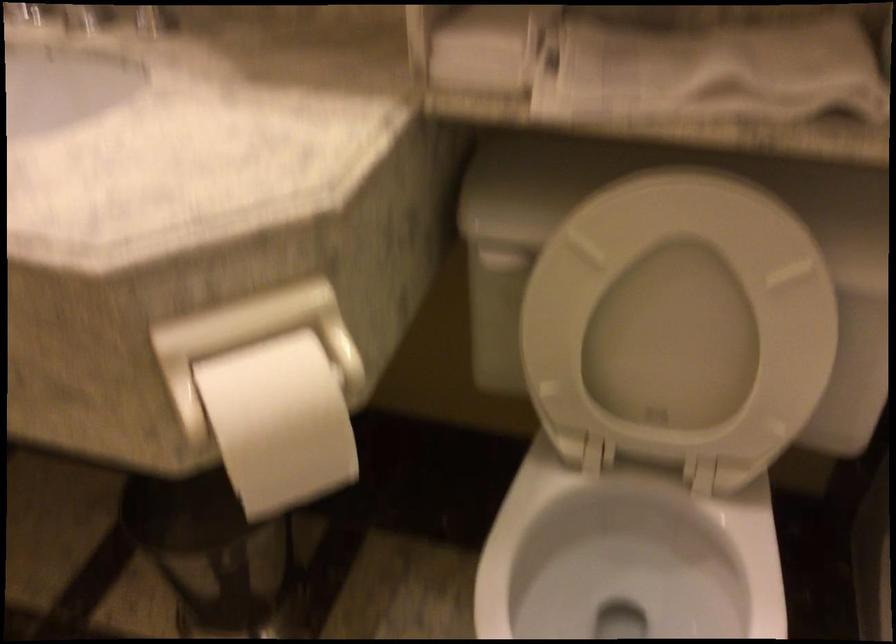
Image resolution: width=896 pixels, height=644 pixels. Describe the element at coordinates (609, 574) in the screenshot. I see `the white toilet seat` at that location.